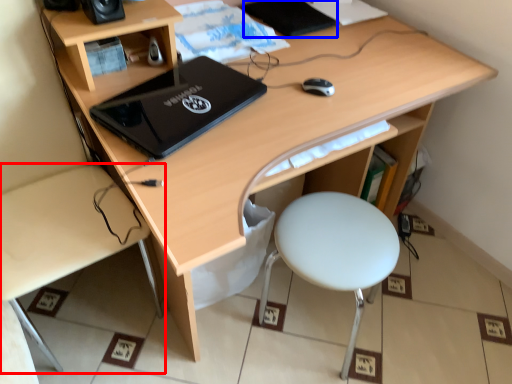
Question: Which object is closer to the camera taking this photo, desk (highlighted by a red box) or notebook (highlighted by a blue box)?

Choices:
 (A) desk
 (B) notebook

Answer: (A)